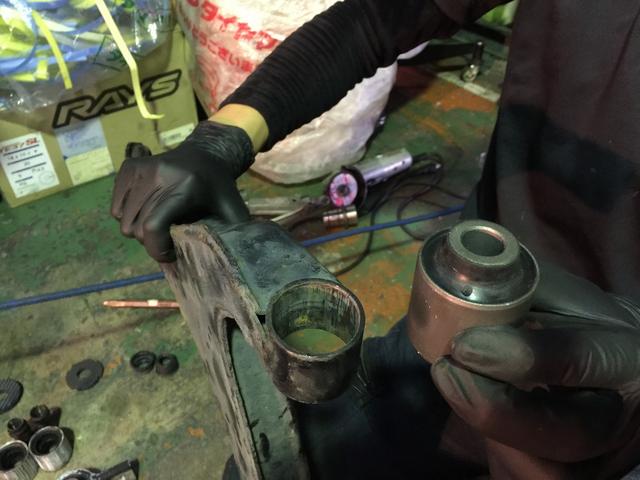
Identify the location of cord. Image resolution: width=640 pixels, height=480 pixels. (425, 230).